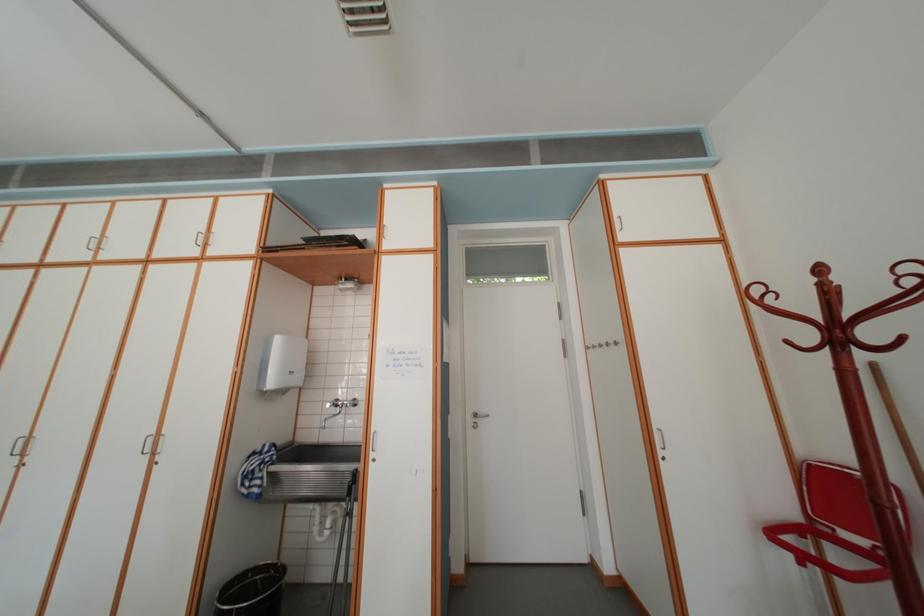
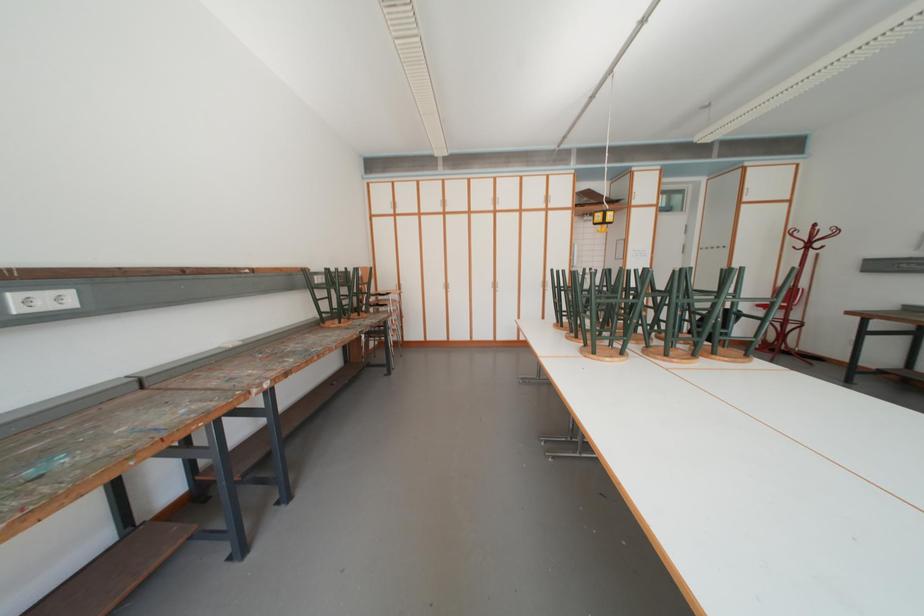
The images are taken continuously from a first-person perspective. In which direction are you moving?

The movement direction of the cameraman is left, backward.